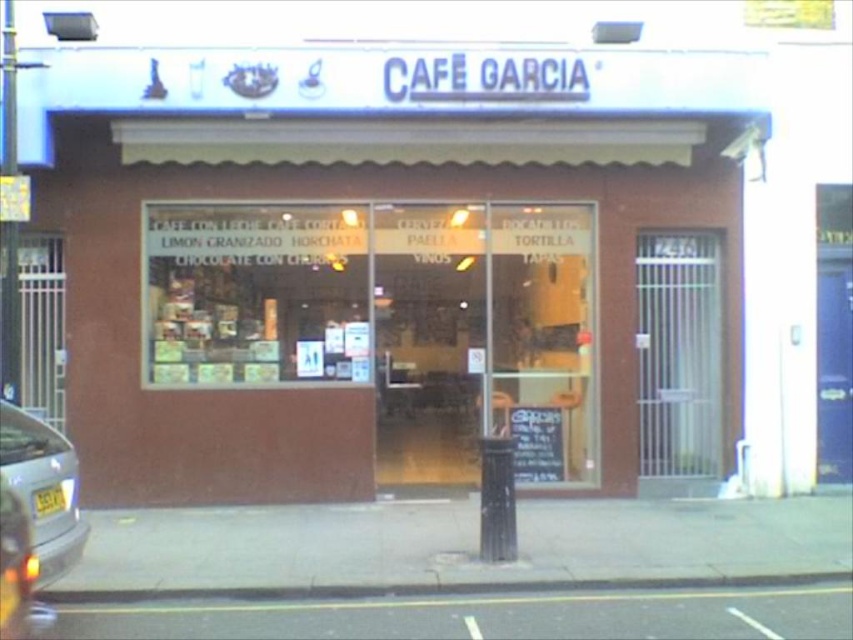
Looking at this image, you are standing in front of the brown brick building at center and want to walk to the silver metallic car at lower left. Which direction should you move to get closer to the car?

The brown brick building at center is closer to you than the silver metallic car at lower left. To reach the car, you should move away from the building towards the lower left direction.

You are a delivery person trying to park your bike near the brown brick building at center and the black asphalt curb at lower center. Since the curb is part of the sidewalk, you need to know which object is higher up from the ground to ensure proper parking. Which one is higher?

The brown brick building at center is located above the black asphalt curb at lower center, so the brown brick building at center is higher up from the ground.

What is the relationship in width between the brown brick building at center and the black asphalt curb at lower center?

The brown brick building at center is wider than the black asphalt curb at lower center according to the description.